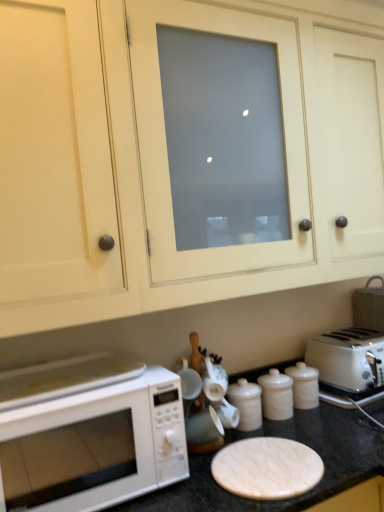
The width and height of the screenshot is (384, 512). Identify the location of empty space that is ontop of white matte microwave at lower left (from a real-world perspective). (71, 372).